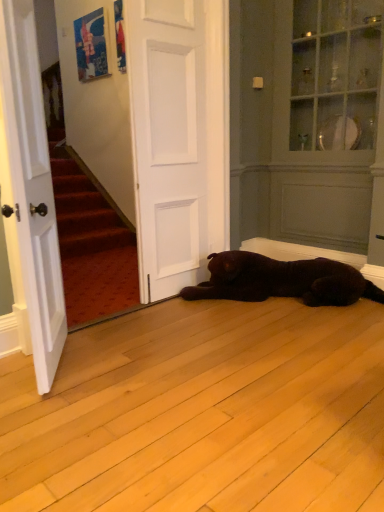
Locate an element on the screen. free space in front of white matte door at center, which is the 1th door from back to front is located at coordinates [x=174, y=319].